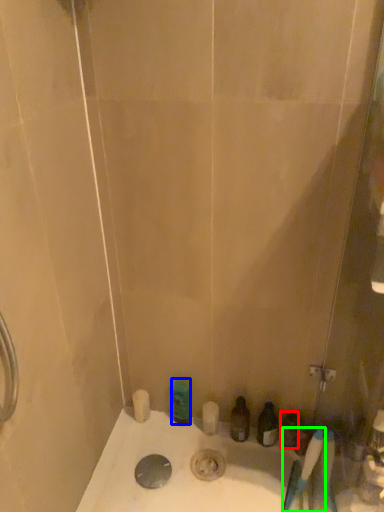
Question: Estimate the real-world distances between objects in this image. Which object is closer to toiletry (highlighted by a red box), toiletry (highlighted by a blue box) or brush (highlighted by a green box)?

Choices:
 (A) toiletry
 (B) brush

Answer: (B)